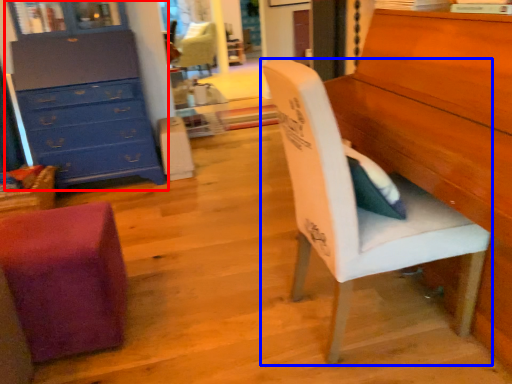
Question: Which object is further to the camera taking this photo, chest of drawers (highlighted by a red box) or chair (highlighted by a blue box)?

Choices:
 (A) chest of drawers
 (B) chair

Answer: (A)